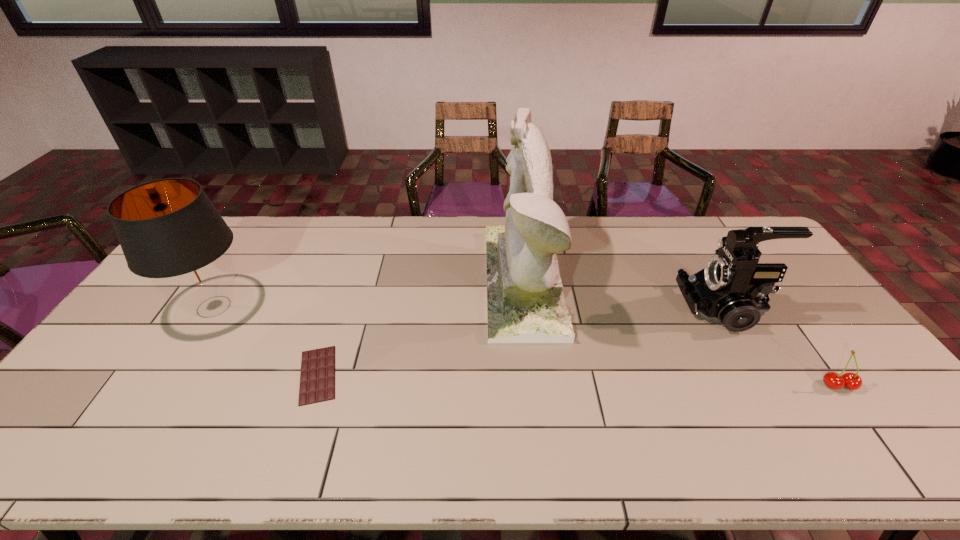
Where is `object at the left edge`? The image size is (960, 540). object at the left edge is located at coordinates coord(169,231).

Where is `object located in the right edge section of the desktop`? This screenshot has height=540, width=960. object located in the right edge section of the desktop is located at coordinates (851, 381).

The height and width of the screenshot is (540, 960). In the image, there is a desktop. Find the location of `vacant space at the far edge`. vacant space at the far edge is located at coordinates (600, 220).

Identify the location of vacant area at the right edge. (793, 280).

Where is `free spot between the third shortest object and the second shortest object`? The width and height of the screenshot is (960, 540). free spot between the third shortest object and the second shortest object is located at coordinates (781, 347).

You are a GUI agent. You are given a task and a screenshot of the screen. Output one action in this format:
    pyautogui.click(x=<x>, y=<y>)
    Task: Click on the free space that is in between the rightmost object and the camcorder
    This screenshot has width=960, height=540.
    Given the screenshot: What is the action you would take?
    pyautogui.click(x=781, y=347)

Locate an element on the screen. free space between the tallest object and the camcorder is located at coordinates (624, 294).

Identify the location of free space between the cherry and the leftmost object. (526, 346).

Find the location of a particular element. Image resolution: width=960 pixels, height=540 pixels. empty space that is in between the third tallest object and the tallest object is located at coordinates (624, 294).

Identify the location of the fourth closest object to the camcorder. This screenshot has height=540, width=960. tap(169, 231).